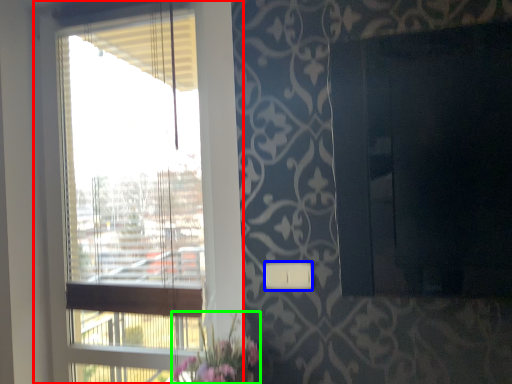
Question: Which object is positioned closest to window (highlighted by a red box)? Select from light switch (highlighted by a blue box) and floral arrangement (highlighted by a green box).

Choices:
 (A) light switch
 (B) floral arrangement

Answer: (B)